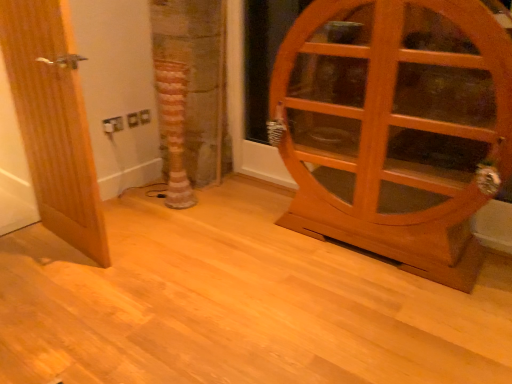
The width and height of the screenshot is (512, 384). I want to click on free space in front of striped fabric tree trunk at center, so click(x=172, y=222).